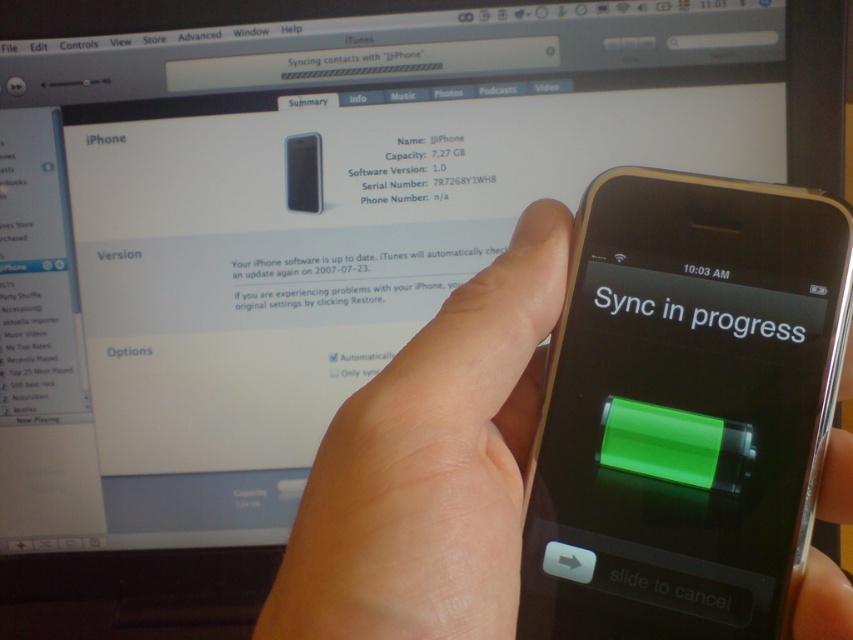
Question: From the image, what is the correct spatial relationship of skinny white hand at center in relation to black matte iphone at center?

Choices:
 (A) above
 (B) below

Answer: (B)

Question: Observing the image, what is the correct spatial positioning of black matte iphone at center in reference to green matte text at center?

Choices:
 (A) above
 (B) below

Answer: (A)

Question: Which of the following is the closest to the observer?

Choices:
 (A) green matte text at center
 (B) black matte iphone at center

Answer: (A)

Question: Which object is the closest to the skinny white hand at center?

Choices:
 (A) black matte iphone at center
 (B) green matte text at center

Answer: (B)

Question: Which of these objects is positioned closest to the skinny white hand at center?

Choices:
 (A) green matte text at center
 (B) black matte iphone at center

Answer: (A)

Question: Does skinny white hand at center have a smaller size compared to black matte iphone at center?

Choices:
 (A) no
 (B) yes

Answer: (A)